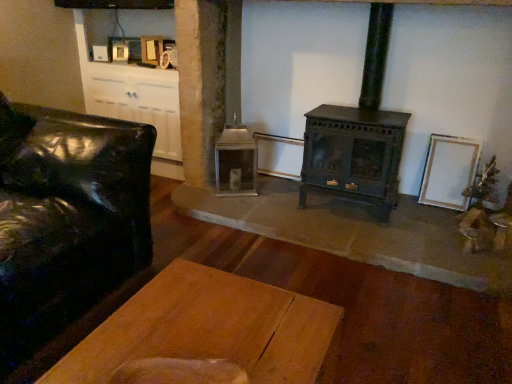
Question: Could you tell me if wooden plank table at center is turned towards white matte picture frame at right?

Choices:
 (A) yes
 (B) no

Answer: (B)

Question: Does wooden plank table at center have a greater width compared to white matte picture frame at right?

Choices:
 (A) no
 (B) yes

Answer: (B)

Question: Is there a large distance between wooden plank table at center and white matte picture frame at right?

Choices:
 (A) yes
 (B) no

Answer: (A)

Question: Can you confirm if wooden plank table at center is positioned to the left of white matte picture frame at right?

Choices:
 (A) no
 (B) yes

Answer: (B)

Question: Is wooden plank table at center looking in the opposite direction of white matte picture frame at right?

Choices:
 (A) yes
 (B) no

Answer: (B)

Question: Can you confirm if wooden plank table at center is taller than white matte picture frame at right?

Choices:
 (A) yes
 (B) no

Answer: (B)

Question: Is green matte wood burning stove at center in front of wooden plank table at center?

Choices:
 (A) no
 (B) yes

Answer: (A)

Question: Are green matte wood burning stove at center and wooden plank table at center making contact?

Choices:
 (A) yes
 (B) no

Answer: (B)

Question: Is green matte wood burning stove at center at the left side of wooden plank table at center?

Choices:
 (A) yes
 (B) no

Answer: (B)

Question: Does green matte wood burning stove at center turn towards wooden plank table at center?

Choices:
 (A) no
 (B) yes

Answer: (B)

Question: Is green matte wood burning stove at center bigger than wooden plank table at center?

Choices:
 (A) no
 (B) yes

Answer: (B)

Question: Is wooden plank table at center inside green matte wood burning stove at center?

Choices:
 (A) yes
 (B) no

Answer: (B)

Question: Can you confirm if wooden plank table at center is shorter than green matte wood burning stove at center?

Choices:
 (A) yes
 (B) no

Answer: (A)